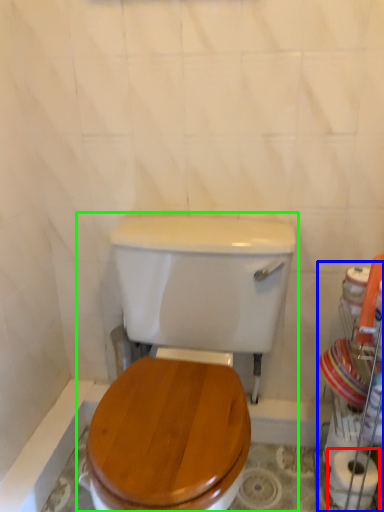
Question: Which is nearer to the toilet paper (highlighted by a red box)? porcelain (highlighted by a blue box) or toilet (highlighted by a green box).

Choices:
 (A) porcelain
 (B) toilet

Answer: (A)